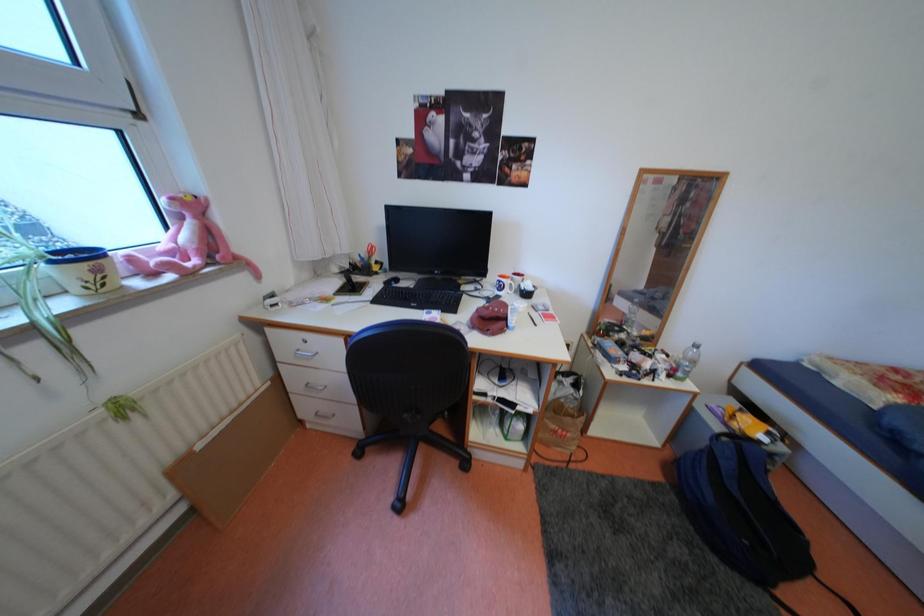
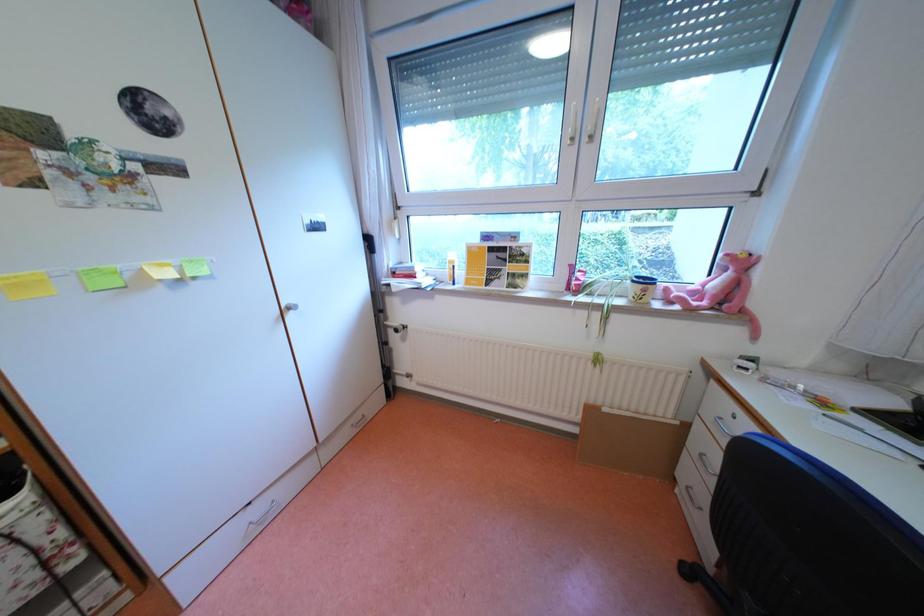
The images are taken continuously from a first-person perspective. In which direction is your viewpoint rotating?

The rotation direction of the camera is left-down.